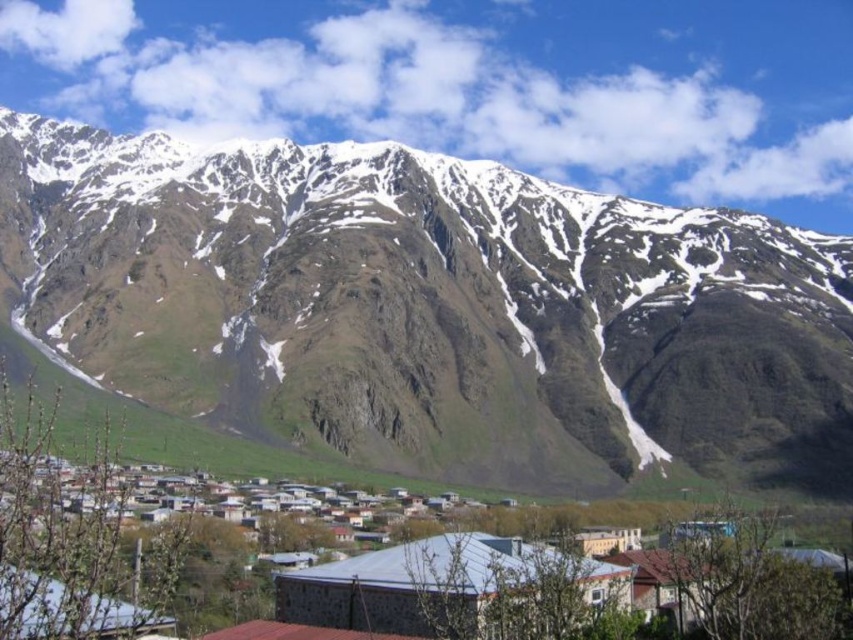
You are a hiker who wants to reach the snowy rock mountain at upper center. Based on the image, what is the approximate 2D coordinate of the mountain?

The snowy rock mountain at upper center is located at the 2D coordinate point of approximately 0.483 on the x axis and 0.505 on the y axis.

You are planning to build a hiking trail from the stone houses at center to the snowy rock mountain at upper center. Considering their sizes, which one would you need to adjust more in terms of elevation changes when designing the trail?

The snowy rock mountain at upper center is bigger than the stone houses at center, so you would need to adjust more elevation changes when designing the trail towards the snowy rock mountain at upper center.